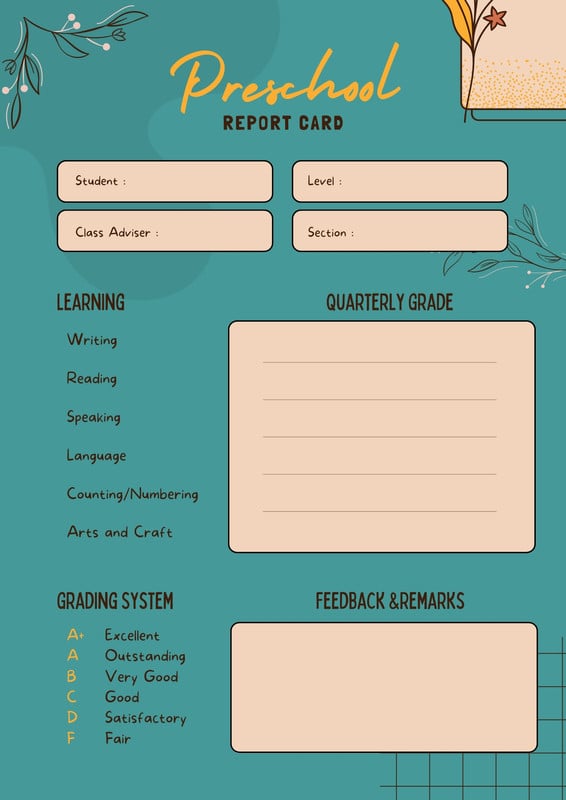
This screenshot has width=566, height=800. In order to click on box in this screenshot , I will do `click(332, 353)`.